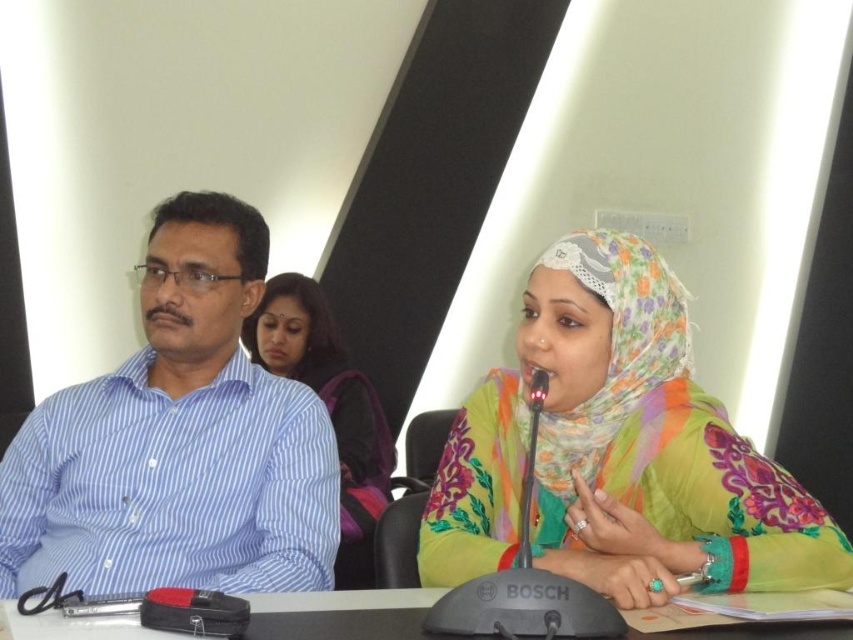
You are standing in the conference room and need to locate the blue striped shirt at left. According to the coordinates provided, where would you find it?

The blue striped shirt at left is located at the 2D coordinates point (178, 440).

You are a photographer adjusting your camera to focus on two points in the image. The first point is at coordinates point (x=57, y=483) and the second point is at point (x=263, y=596). Which point should you focus on first if you want to capture the closest object to the camera?

You should focus on point (x=57, y=483) first because it is closer to the camera than point (x=263, y=596).

You are organizing a photo shoot and need to ensure that the floral fabric hijab at center and the blue striped shirt at left are both visible in the frame. Given their sizes, which one might require more space in the composition?

The floral fabric hijab at center requires more space in the composition because it is larger in size than the blue striped shirt at left.